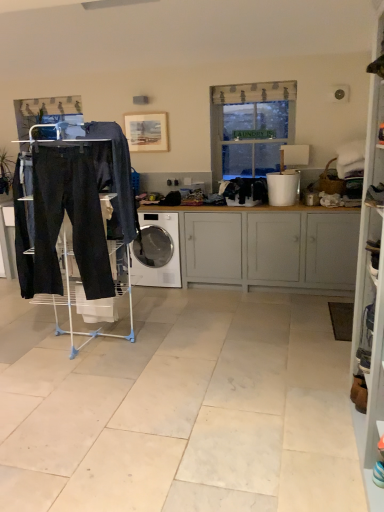
Question: Can you confirm if black fabric clothes at center, which appears as the 1th clothing when viewed from the back, is positioned to the left of white glossy washing machine at center?

Choices:
 (A) yes
 (B) no

Answer: (B)

Question: Does black fabric clothes at center, which appears as the 1th clothing when viewed from the back, lie behind white glossy washing machine at center?

Choices:
 (A) yes
 (B) no

Answer: (B)

Question: Is black fabric clothes at center, positioned as the second clothing in front-to-back order, not within white glossy washing machine at center?

Choices:
 (A) no
 (B) yes

Answer: (B)

Question: Is black fabric clothes at center, which is the 1th clothing in right-to-left order, positioned far away from white glossy washing machine at center?

Choices:
 (A) yes
 (B) no

Answer: (B)

Question: Is black fabric clothes at center, which appears as the 2th clothing when viewed from the left, thinner than white glossy washing machine at center?

Choices:
 (A) yes
 (B) no

Answer: (A)

Question: Considering the positions of white glossy washing machine at center and wooden frame at upper center in the image, is white glossy washing machine at center wider or thinner than wooden frame at upper center?

Choices:
 (A) wide
 (B) thin

Answer: (A)

Question: From the image's perspective, relative to wooden frame at upper center, is white glossy washing machine at center above or below?

Choices:
 (A) above
 (B) below

Answer: (B)

Question: Relative to wooden frame at upper center, is white glossy washing machine at center in front or behind?

Choices:
 (A) behind
 (B) front

Answer: (B)

Question: Is white glossy washing machine at center bigger or smaller than wooden frame at upper center?

Choices:
 (A) big
 (B) small

Answer: (A)

Question: Based on their sizes in the image, would you say dark gray fabric pants at center, which appears as the 1th clothing when viewed from the left, is bigger or smaller than white painted wood cabinet at center?

Choices:
 (A) small
 (B) big

Answer: (A)

Question: From the image's perspective, is dark gray fabric pants at center, which ranks as the 2th clothing in right-to-left order, located above or below white painted wood cabinet at center?

Choices:
 (A) below
 (B) above

Answer: (B)

Question: Visually, is dark gray fabric pants at center, which appears as the 1th clothing when viewed from the left, positioned to the left or to the right of white painted wood cabinet at center?

Choices:
 (A) left
 (B) right

Answer: (A)

Question: In terms of width, does dark gray fabric pants at center, marked as the second clothing in a back-to-front arrangement, look wider or thinner when compared to white painted wood cabinet at center?

Choices:
 (A) wide
 (B) thin

Answer: (B)

Question: Does point (225, 125) appear closer or farther from the camera than point (271, 199)?

Choices:
 (A) farther
 (B) closer

Answer: (A)

Question: Based on their positions, is translucent fabric window at center located to the left or right of white plastic bucket at right?

Choices:
 (A) right
 (B) left

Answer: (B)